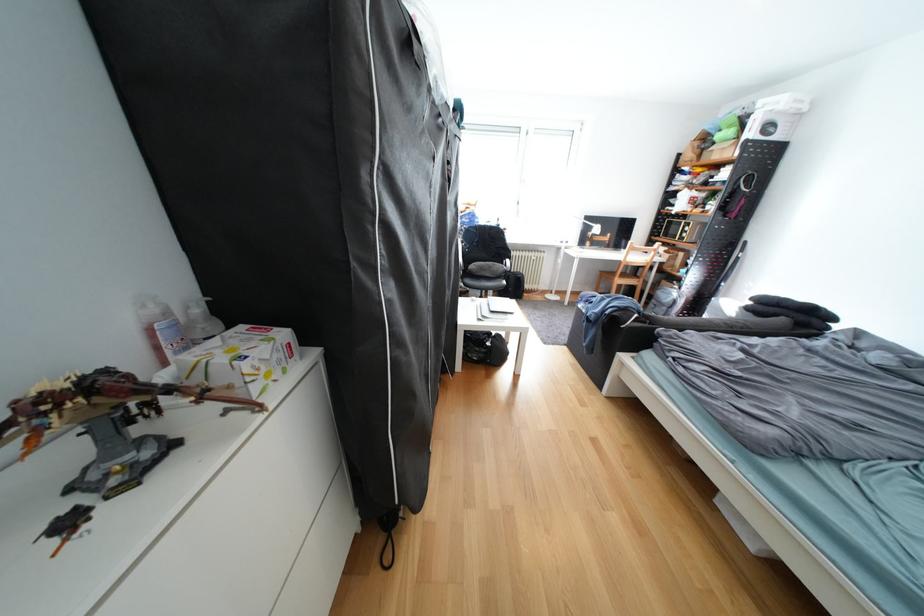
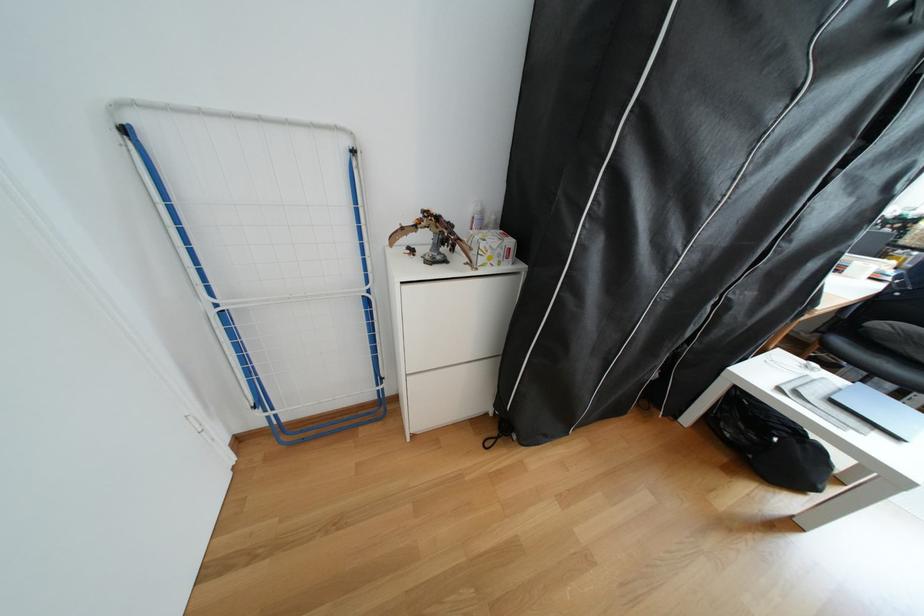
The point at (488, 359) is marked in the first image. Where is the corresponding point in the second image?

(739, 436)